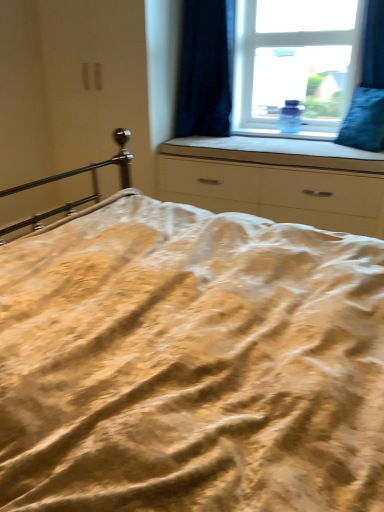
Question: Considering the positions of blue velvet pillow at right and transparent glass window at upper center in the image, is blue velvet pillow at right taller or shorter than transparent glass window at upper center?

Choices:
 (A) short
 (B) tall

Answer: (A)

Question: From the image's perspective, is blue velvet pillow at right located above or below transparent glass window at upper center?

Choices:
 (A) above
 (B) below

Answer: (B)

Question: Which of these objects is positioned closest to the dark blue velvet curtain at upper right?

Choices:
 (A) white matte chest of drawers at center
 (B) transparent glass window at upper center
 (C) blue velvet pillow at right
 (D) white fabric at center

Answer: (B)

Question: Estimate the real-world distances between objects in this image. Which object is closer to the blue velvet pillow at right?

Choices:
 (A) white matte chest of drawers at center
 (B) transparent glass window at upper center
 (C) white fabric at center
 (D) dark blue velvet curtain at upper right

Answer: (C)